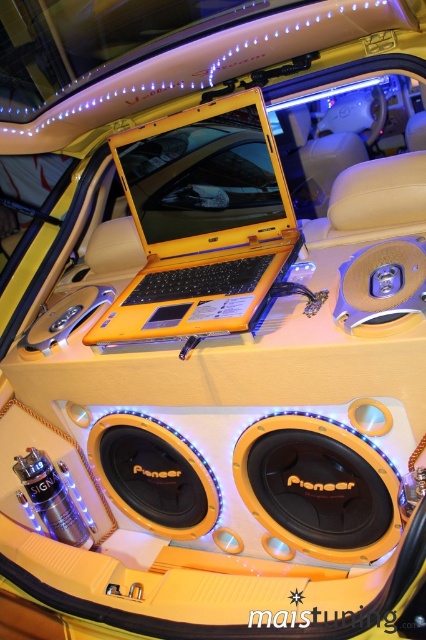
You are a technician inspecting the car interior. You need to access the yellow matte laptop at center for system updates. Given that the yellow matte pioneer speaker at center is in the way, can you move it to the left to make space? Explain your reasoning based on their positions.

The yellow matte pioneer speaker at center is to the right of the yellow matte laptop at center. Moving it to the left would place it directly next to the laptop, creating space on its original position to the right. However, since the speaker is already positioned to the right of the laptop, moving it left might interfere with the laptop or other components. The feasibility depends on available space and clearance, but according to the given description, the speaker is positioned to the right, so moving it

You are a technician who needs to place a new device between the yellow matte laptop at center and the metallic gold speaker at center. The device requires a space that is wider than the widest object between them. Which object should you measure to determine the minimum required width?

You should measure the yellow matte laptop at center because its width surpasses that of the metallic gold speaker at center, making it the wider object between the two.

You are a technician working on the car audio system. You need to access the laptop to adjust the settings. Given that the yellow matte laptop at center is above the yellow matte pioneer speaker at center, which object should you move first to reach the laptop?

The yellow matte pioneer speaker at center must be moved first because it is positioned below the yellow matte laptop at center, so moving it would allow access to the laptop.